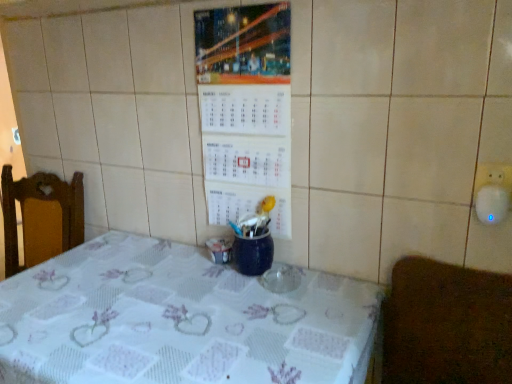
Question: Does white printed tablecloth at center have a smaller size compared to brown textured mat at lower right?

Choices:
 (A) yes
 (B) no

Answer: (B)

Question: Does white printed tablecloth at center have a greater height compared to brown textured mat at lower right?

Choices:
 (A) yes
 (B) no

Answer: (A)

Question: Considering the relative sizes of white printed tablecloth at center and brown textured mat at lower right in the image provided, is white printed tablecloth at center wider than brown textured mat at lower right?

Choices:
 (A) yes
 (B) no

Answer: (A)

Question: Is white printed tablecloth at center completely or partially outside of brown textured mat at lower right?

Choices:
 (A) yes
 (B) no

Answer: (A)

Question: From a real-world perspective, is white printed tablecloth at center positioned under brown textured mat at lower right based on gravity?

Choices:
 (A) yes
 (B) no

Answer: (A)

Question: Considering the positions of point (44, 382) and point (462, 345), is point (44, 382) closer or farther from the camera than point (462, 345)?

Choices:
 (A) farther
 (B) closer

Answer: (B)

Question: Is white printed tablecloth at center taller or shorter than brown textured mat at lower right?

Choices:
 (A) tall
 (B) short

Answer: (A)

Question: Considering the positions of white printed tablecloth at center and brown textured mat at lower right in the image, is white printed tablecloth at center wider or thinner than brown textured mat at lower right?

Choices:
 (A) thin
 (B) wide

Answer: (B)

Question: Is white printed tablecloth at center bigger or smaller than brown textured mat at lower right?

Choices:
 (A) big
 (B) small

Answer: (A)

Question: Looking at their shapes, would you say brown textured mat at lower right is wider or thinner than white printed tablecloth at center?

Choices:
 (A) thin
 (B) wide

Answer: (A)

Question: Considering the positions of brown textured mat at lower right and white printed tablecloth at center in the image, is brown textured mat at lower right bigger or smaller than white printed tablecloth at center?

Choices:
 (A) small
 (B) big

Answer: (A)

Question: Considering their positions, is brown textured mat at lower right located in front of or behind white printed tablecloth at center?

Choices:
 (A) behind
 (B) front

Answer: (B)

Question: From a real-world perspective, is brown textured mat at lower right above or below white printed tablecloth at center?

Choices:
 (A) above
 (B) below

Answer: (A)

Question: Does point (236, 213) appear closer or farther from the camera than point (422, 291)?

Choices:
 (A) closer
 (B) farther

Answer: (B)

Question: Is white paper calendar at center wider or thinner than brown textured mat at lower right?

Choices:
 (A) thin
 (B) wide

Answer: (A)